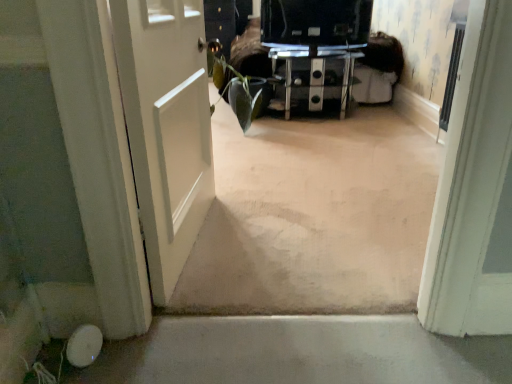
Question: Is white matte door at left oriented away from black glossy tv at center?

Choices:
 (A) no
 (B) yes

Answer: (A)

Question: Does white matte door at left lie behind black glossy tv at center?

Choices:
 (A) no
 (B) yes

Answer: (A)

Question: Can black glossy tv at center be found inside white matte door at left?

Choices:
 (A) yes
 (B) no

Answer: (B)

Question: Is white matte door at left smaller than black glossy tv at center?

Choices:
 (A) yes
 (B) no

Answer: (B)

Question: Can we say white matte door at left lies outside black glossy tv at center?

Choices:
 (A) yes
 (B) no

Answer: (A)

Question: Can you confirm if white matte door at left is bigger than black glossy tv at center?

Choices:
 (A) no
 (B) yes

Answer: (B)

Question: Is black glass tv stand at center smaller than black glossy tv at center?

Choices:
 (A) no
 (B) yes

Answer: (A)

Question: From the image's perspective, does black glass tv stand at center appear lower than black glossy tv at center?

Choices:
 (A) yes
 (B) no

Answer: (A)

Question: Is black glass tv stand at center aimed at black glossy tv at center?

Choices:
 (A) no
 (B) yes

Answer: (A)

Question: Can you confirm if black glass tv stand at center is positioned to the left of black glossy tv at center?

Choices:
 (A) no
 (B) yes

Answer: (A)

Question: Does black glass tv stand at center have a greater height compared to black glossy tv at center?

Choices:
 (A) yes
 (B) no

Answer: (A)

Question: Is black glossy tv at center completely or partially inside black glass tv stand at center?

Choices:
 (A) no
 (B) yes

Answer: (A)

Question: Considering the relative positions of black glossy tv at center and black glass tv stand at center in the image provided, is black glossy tv at center to the right of black glass tv stand at center from the viewer's perspective?

Choices:
 (A) no
 (B) yes

Answer: (A)